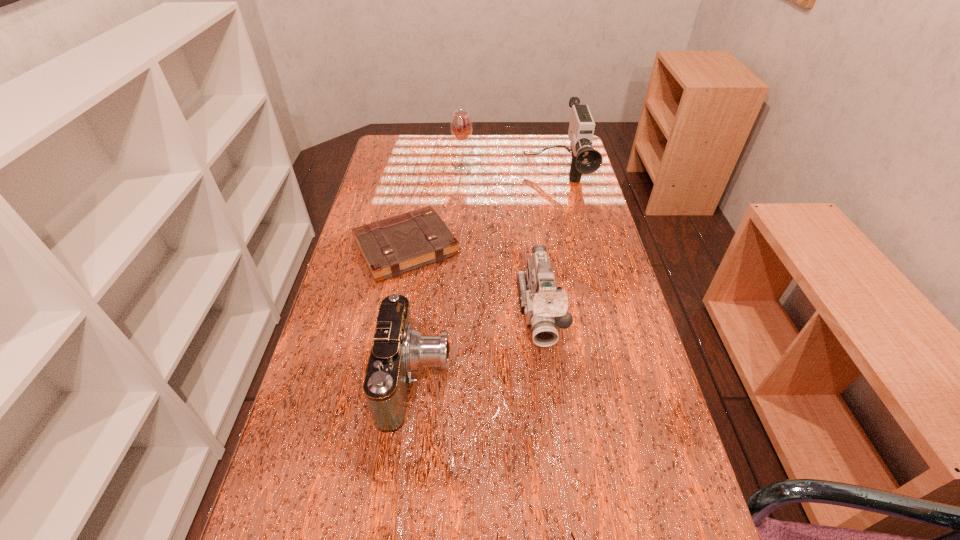
The width and height of the screenshot is (960, 540). In order to click on vacant area that lies between the fifth tallest object and the wineglass in this screenshot , I will do `click(435, 207)`.

Identify the location of object that can be found as the third closest to the wineglass. This screenshot has width=960, height=540. (545, 306).

Identify the location of object identified as the closest to the wineglass. The height and width of the screenshot is (540, 960). (585, 159).

The width and height of the screenshot is (960, 540). In order to click on camcorder that stands as the third closest to the wineglass in this screenshot , I will do `click(398, 349)`.

Identify the location of camcorder that is the closest to the spectacles. (398, 349).

Identify the location of vacant region that satisfies the following two spatial constraints: 1. on the recording direction of the tallest camcorder; 2. on the front-facing side of the leftmost camcorder. This screenshot has width=960, height=540. (598, 377).